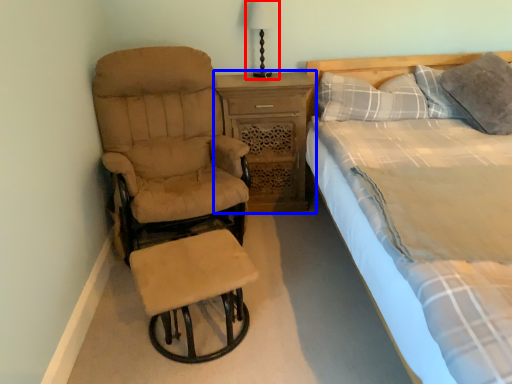
Question: Which object appears closest to the camera in this image, bedside lamp (highlighted by a red box) or nightstand (highlighted by a blue box)?

Choices:
 (A) bedside lamp
 (B) nightstand

Answer: (B)